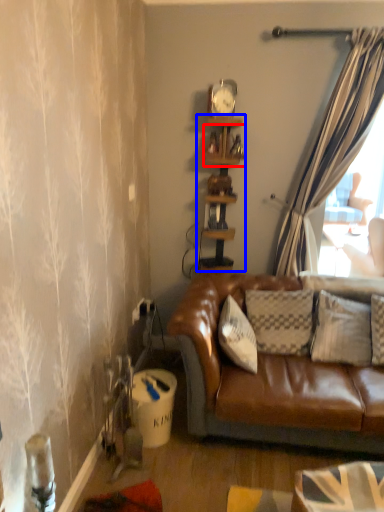
Question: Among these objects, which one is farthest to the camera, shelf (highlighted by a red box) or shelf (highlighted by a blue box)?

Choices:
 (A) shelf
 (B) shelf

Answer: (A)